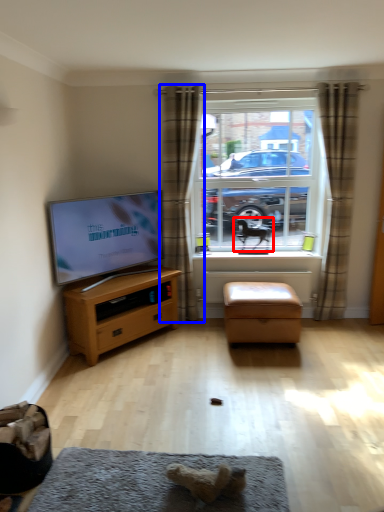
Question: Which object appears closest to the camera in this image, animal (highlighted by a red box) or curtain (highlighted by a blue box)?

Choices:
 (A) animal
 (B) curtain

Answer: (B)